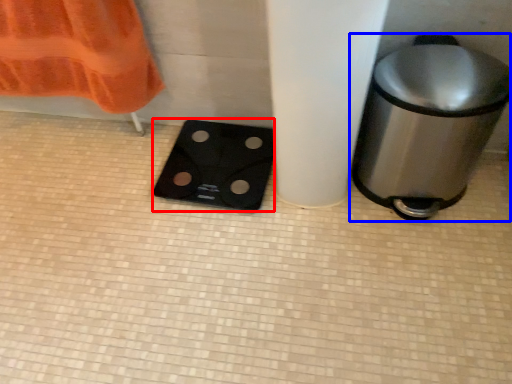
Question: Which object is further to the camera taking this photo, appliance (highlighted by a red box) or waste container (highlighted by a blue box)?

Choices:
 (A) appliance
 (B) waste container

Answer: (A)